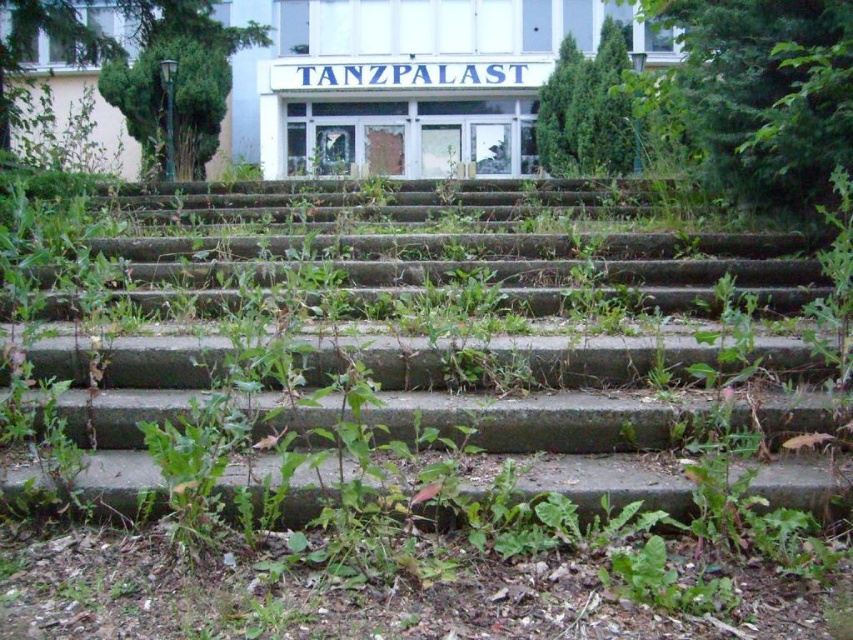
Question: Is green concrete stairs at center behind green leafy shrub at upper center?

Choices:
 (A) no
 (B) yes

Answer: (A)

Question: Which point is closer to the camera taking this photo?

Choices:
 (A) (572, 387)
 (B) (630, 42)

Answer: (A)

Question: Which point appears closest to the camera in this image?

Choices:
 (A) (546, 115)
 (B) (759, 266)

Answer: (B)

Question: Does green concrete stairs at center appear under green leafy shrub at upper center?

Choices:
 (A) no
 (B) yes

Answer: (B)

Question: Is green concrete stairs at center to the left of green leafy shrub at upper center from the viewer's perspective?

Choices:
 (A) no
 (B) yes

Answer: (B)